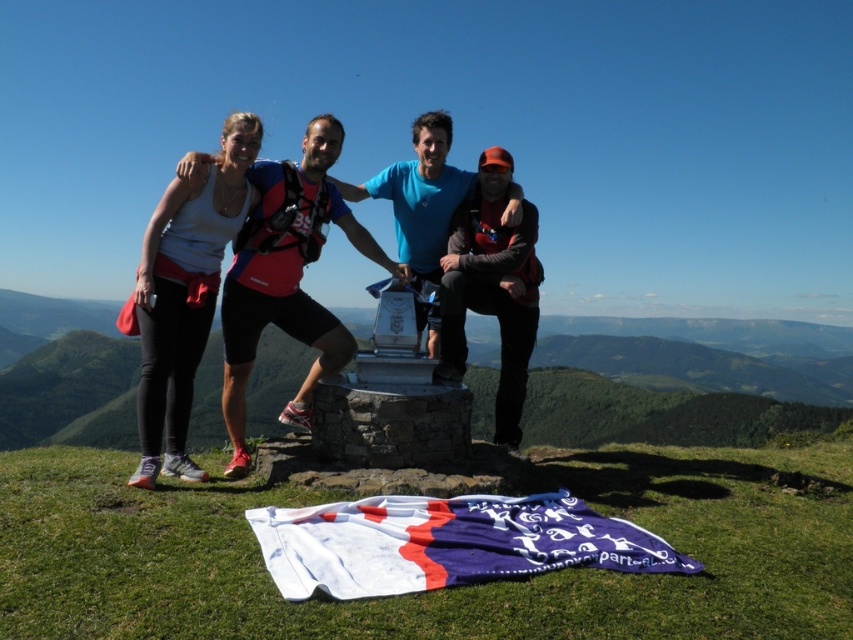
Question: Among these points, which one is nearest to the camera?

Choices:
 (A) (212, 401)
 (B) (242, 208)
 (C) (405, 563)

Answer: (C)

Question: Is silver metallic monument at center smaller than matte blue shirt at center?

Choices:
 (A) no
 (B) yes

Answer: (A)

Question: Which point is farther to the camera?

Choices:
 (A) (639, 380)
 (B) (225, 118)
 (C) (413, 132)

Answer: (A)

Question: Which object is positioned farthest from the silver metallic monument at center?

Choices:
 (A) blue cotton flag at lower center
 (B) white matte tank top at upper left
 (C) matte gray backpack at center
 (D) matte blue shirt at center

Answer: (B)

Question: Can you confirm if matte blue shirt at center is thinner than matte gray backpack at center?

Choices:
 (A) no
 (B) yes

Answer: (A)

Question: Does silver metallic monument at center come behind matte gray backpack at center?

Choices:
 (A) no
 (B) yes

Answer: (B)